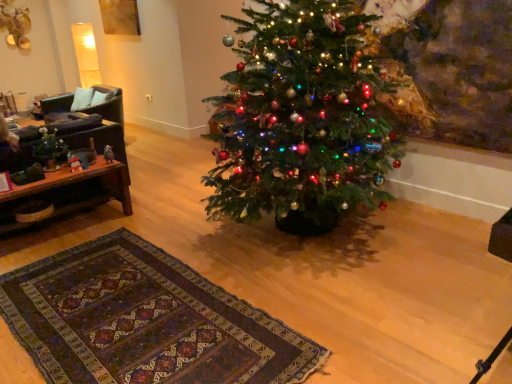
Question: From a real-world perspective, is black leather armchair at left beneath matte black vase at left?

Choices:
 (A) yes
 (B) no

Answer: (A)

Question: From a real-world perspective, is black leather armchair at left positioned over matte black vase at left based on gravity?

Choices:
 (A) yes
 (B) no

Answer: (B)

Question: Does black leather armchair at left appear on the right side of matte black vase at left?

Choices:
 (A) yes
 (B) no

Answer: (B)

Question: From the image's perspective, does black leather armchair at left appear higher than matte black vase at left?

Choices:
 (A) yes
 (B) no

Answer: (A)

Question: Does black leather armchair at left lie in front of matte black vase at left?

Choices:
 (A) no
 (B) yes

Answer: (A)

Question: Is black leather armchair at left completely or partially outside of matte black vase at left?

Choices:
 (A) yes
 (B) no

Answer: (A)

Question: Does brown wooden table at left have a larger size compared to matte black vase at left?

Choices:
 (A) yes
 (B) no

Answer: (A)

Question: Is brown wooden table at left looking in the opposite direction of matte black vase at left?

Choices:
 (A) no
 (B) yes

Answer: (A)

Question: Would you say matte black vase at left is part of brown wooden table at left's contents?

Choices:
 (A) yes
 (B) no

Answer: (B)

Question: Would you say brown wooden table at left is a long distance from matte black vase at left?

Choices:
 (A) no
 (B) yes

Answer: (A)

Question: Considering the relative sizes of brown wooden table at left and matte black vase at left in the image provided, is brown wooden table at left taller than matte black vase at left?

Choices:
 (A) no
 (B) yes

Answer: (B)

Question: Is brown wooden table at left at the left side of matte black vase at left?

Choices:
 (A) yes
 (B) no

Answer: (B)

Question: From the image's perspective, is brown wooden table at left over black leather armchair at left?

Choices:
 (A) no
 (B) yes

Answer: (A)